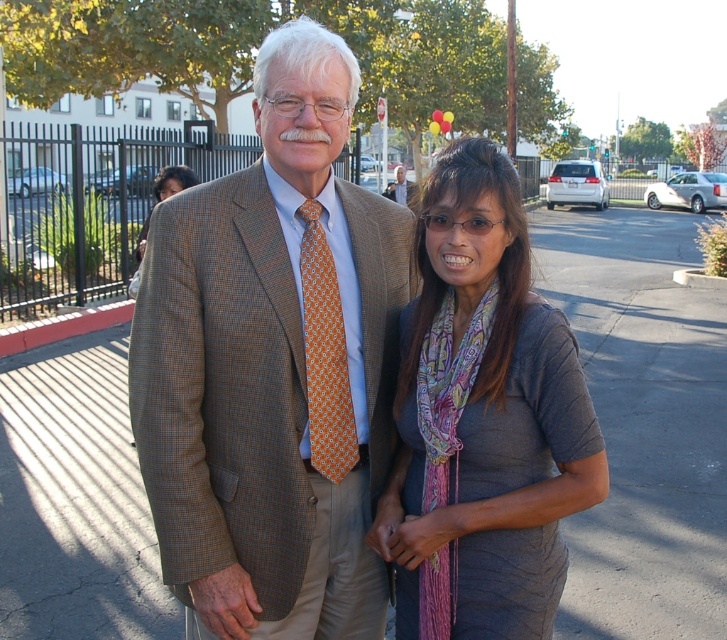
Can you confirm if orange printed tie at center is positioned below orange patterned tie at center?

Indeed, orange printed tie at center is positioned under orange patterned tie at center.

Find the location of a particular element. This screenshot has height=640, width=727. orange printed tie at center is located at coordinates (324, 353).

Where is `orange printed tie at center`? Image resolution: width=727 pixels, height=640 pixels. orange printed tie at center is located at coordinates (324, 353).

From the picture: Can you confirm if gray asphalt pavement at center is positioned to the right of orange printed tie at center?

Indeed, gray asphalt pavement at center is positioned on the right side of orange printed tie at center.

Between gray asphalt pavement at center and orange printed tie at center, which one appears on the right side from the viewer's perspective?

gray asphalt pavement at center

Which is behind, point (562, 304) or point (310, 244)?

Point (562, 304)

Where is `gray asphalt pavement at center`? This screenshot has width=727, height=640. gray asphalt pavement at center is located at coordinates (x=643, y=424).

Locate an element on the screen. This screenshot has height=640, width=727. brown textured suit at center is located at coordinates (273, 368).

Can you confirm if brown textured suit at center is positioned above orange patterned tie at center?

Actually, brown textured suit at center is below orange patterned tie at center.

Is point (326, 540) closer to viewer compared to point (401, 168)?

That is True.

The height and width of the screenshot is (640, 727). I want to click on brown textured suit at center, so click(x=273, y=368).